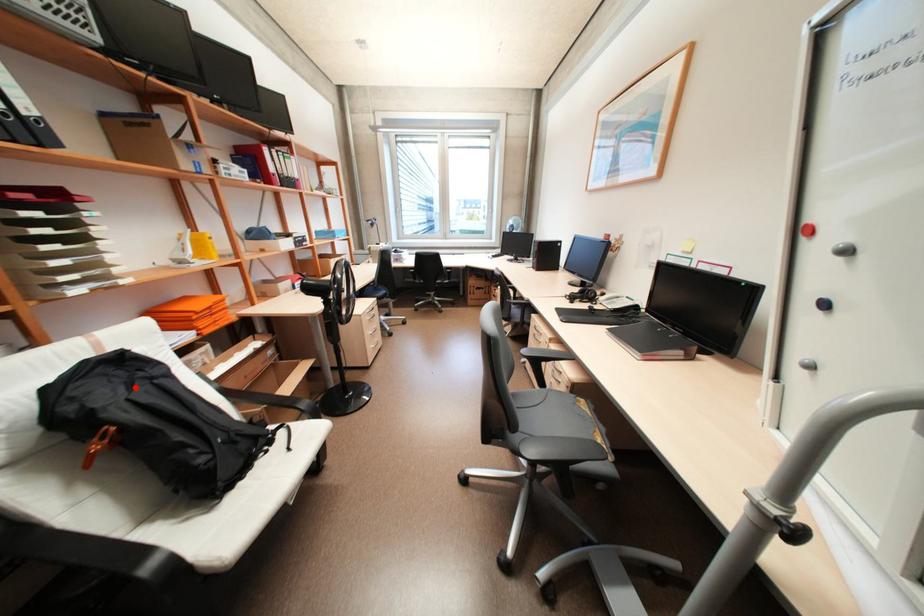
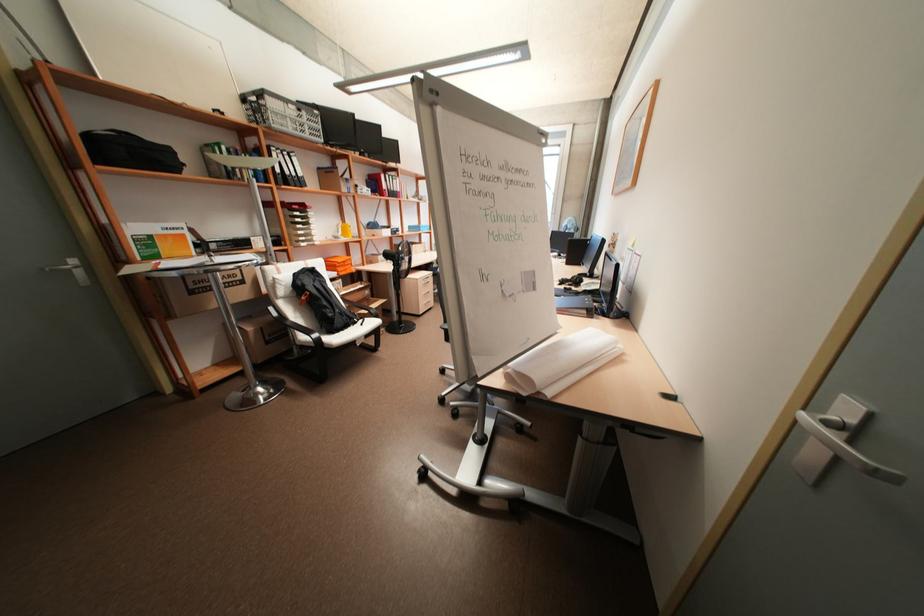
Locate, in the second image, the point that corresponds to the highlighted location in the first image.

(320, 281)